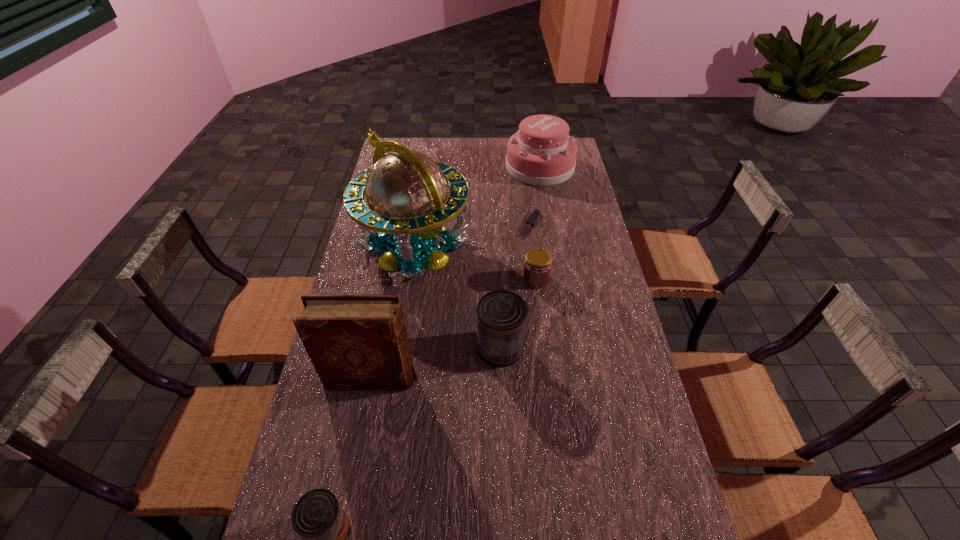
Locate an element on the screen. This screenshot has width=960, height=540. the right can is located at coordinates (501, 314).

Image resolution: width=960 pixels, height=540 pixels. What are the coordinates of `the taller can` in the screenshot? It's located at (501, 314).

The image size is (960, 540). I want to click on steak knife, so click(536, 212).

Find the location of a particular element. The width and height of the screenshot is (960, 540). birthday cake is located at coordinates (541, 153).

The image size is (960, 540). I want to click on globe, so click(406, 191).

The width and height of the screenshot is (960, 540). Identify the location of hardback book. (355, 342).

The image size is (960, 540). In order to click on the sixth tallest object in this screenshot , I will do `click(537, 267)`.

This screenshot has height=540, width=960. In order to click on free space located on the right of the right can in this screenshot , I will do `click(543, 348)`.

You are a GUI agent. You are given a task and a screenshot of the screen. Output one action in this format:
    pyautogui.click(x=<x>, y=<y>)
    Task: Click on the vacant space situated on the left of the steak knife
    The width and height of the screenshot is (960, 540).
    Given the screenshot: What is the action you would take?
    pyautogui.click(x=504, y=225)

The width and height of the screenshot is (960, 540). Identify the location of free location located on the left of the birthday cake. (470, 167).